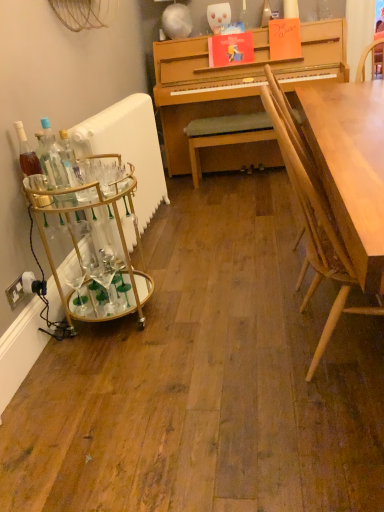
Question: In terms of height, does clear glass bottle at left, the 1th bottle in the right-to-left sequence, look taller or shorter compared to light brown wood chair at right?

Choices:
 (A) tall
 (B) short

Answer: (B)

Question: Considering the positions of point (54, 180) and point (299, 207), is point (54, 180) closer or farther from the camera than point (299, 207)?

Choices:
 (A) farther
 (B) closer

Answer: (A)

Question: Based on their relative distances, which object is nearer to the white plastic power outlet at lower left?

Choices:
 (A) white glossy radiator at left
 (B) translucent glass bottle at left, the 2th bottle when ordered from right to left
 (C) gold metallic bar cart at left
 (D) clear glass bottle at left, placed as the 2th bottle when sorted from left to right
 (E) light brown wood chair at right

Answer: (C)

Question: Which object is the farthest from the clear glass bottle at left, the 1th bottle in the right-to-left sequence?

Choices:
 (A) gold metallic bar cart at left
 (B) translucent glass bottle at left, the first bottle in the left-to-right sequence
 (C) light brown wood chair at right
 (D) white glossy radiator at left
 (E) white plastic power outlet at lower left

Answer: (C)